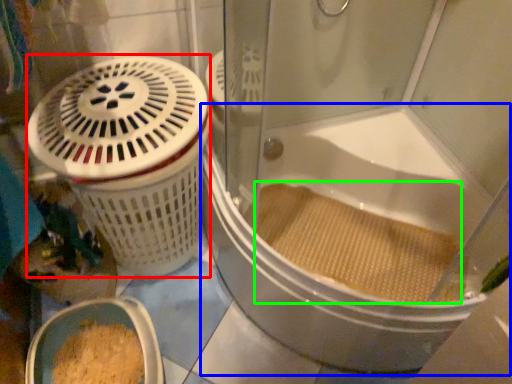
Question: Which is farther away from basket container (highlighted by a red box)? bathtub (highlighted by a blue box) or debris (highlighted by a green box)?

Choices:
 (A) bathtub
 (B) debris

Answer: (B)